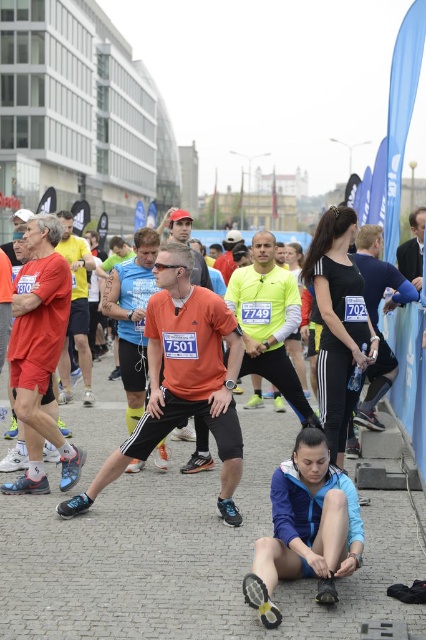
Can you confirm if blue fabric jacket at lower center is positioned to the left of black matte running shoes at center?

Indeed, blue fabric jacket at lower center is positioned on the left side of black matte running shoes at center.

Can you confirm if blue fabric jacket at lower center is positioned below black matte running shoes at center?

Correct, blue fabric jacket at lower center is located below black matte running shoes at center.

Does point (356, 496) come behind point (337, 424)?

No, it is in front of (337, 424).

Where is `blue fabric jacket at lower center`? The height and width of the screenshot is (640, 426). blue fabric jacket at lower center is located at coordinates (305, 528).